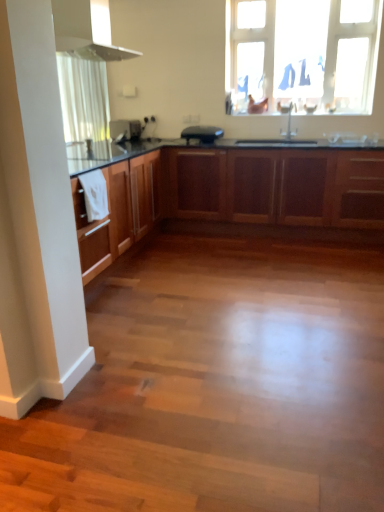
Question: Is wooden cabinets at center taller or shorter than white sheer curtain at upper left?

Choices:
 (A) tall
 (B) short

Answer: (B)

Question: Is wooden cabinets at center to the left or to the right of white sheer curtain at upper left in the image?

Choices:
 (A) right
 (B) left

Answer: (A)

Question: Which object is positioned farthest from the white glossy exhaust hood at upper center?

Choices:
 (A) satin nickel faucet at upper center
 (B) black matte toaster at center, the 2th appliance positioned from the left
 (C) white sheer curtain at upper left
 (D) wooden cabinets at center
 (E) transparent plastic window at upper center

Answer: (A)

Question: Which object is positioned closest to the wooden cabinets at center?

Choices:
 (A) transparent plastic window at upper center
 (B) white sheer curtain at upper left
 (C) white glossy exhaust hood at upper center
 (D) satin black toaster at center, which is the second appliance in right-to-left order
 (E) black matte toaster at center, the 2th appliance positioned from the left

Answer: (E)